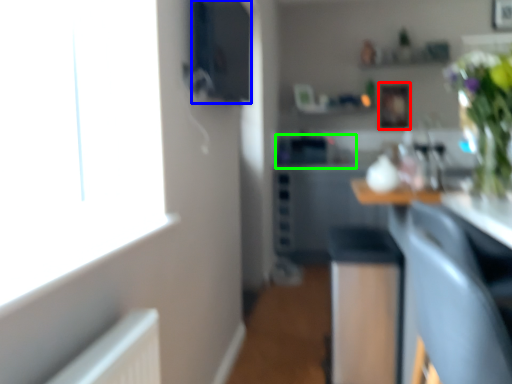
Question: Considering the real-world distances, which object is closest to picture frame (highlighted by a red box)? appliance (highlighted by a blue box) or sink (highlighted by a green box).

Choices:
 (A) appliance
 (B) sink

Answer: (B)